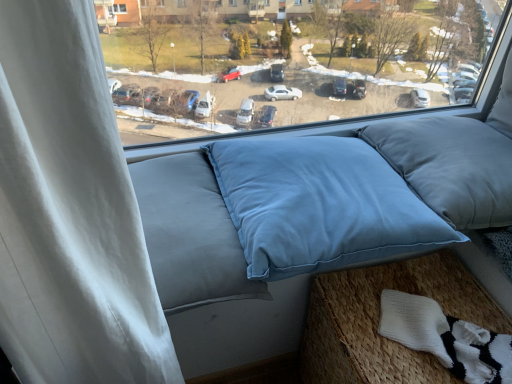
Question: From the image's perspective, is light blue fabric cushion at lower right located above white knitted socks at lower right?

Choices:
 (A) yes
 (B) no

Answer: (B)

Question: Does light blue fabric cushion at lower right lie behind white knitted socks at lower right?

Choices:
 (A) yes
 (B) no

Answer: (B)

Question: Can you confirm if light blue fabric cushion at lower right is wider than white knitted socks at lower right?

Choices:
 (A) no
 (B) yes

Answer: (B)

Question: From a real-world perspective, is light blue fabric cushion at lower right under white knitted socks at lower right?

Choices:
 (A) no
 (B) yes

Answer: (B)

Question: Would you consider light blue fabric cushion at lower right to be distant from white knitted socks at lower right?

Choices:
 (A) no
 (B) yes

Answer: (A)

Question: Is light blue fabric cushion at lower right bigger or smaller than white knitted socks at lower right?

Choices:
 (A) small
 (B) big

Answer: (B)

Question: Do you think light blue fabric cushion at lower right is within white knitted socks at lower right, or outside of it?

Choices:
 (A) inside
 (B) outside

Answer: (B)

Question: Considering the positions of light blue fabric cushion at lower right and white knitted socks at lower right in the image, is light blue fabric cushion at lower right wider or thinner than white knitted socks at lower right?

Choices:
 (A) thin
 (B) wide

Answer: (B)

Question: From the image's perspective, is light blue fabric cushion at lower right positioned above or below white knitted socks at lower right?

Choices:
 (A) above
 (B) below

Answer: (B)

Question: In terms of height, does blue fabric pillows at center look taller or shorter compared to blue fabric pillow at center, the first pillow from the left?

Choices:
 (A) short
 (B) tall

Answer: (B)

Question: Considering the positions of blue fabric pillows at center and blue fabric pillow at center, the first pillow from the left, in the image, is blue fabric pillows at center wider or thinner than blue fabric pillow at center, the first pillow from the left,?

Choices:
 (A) thin
 (B) wide

Answer: (A)

Question: Based on their sizes in the image, would you say blue fabric pillows at center is bigger or smaller than blue fabric pillow at center, the first pillow from the left?

Choices:
 (A) big
 (B) small

Answer: (A)

Question: From the image's perspective, is blue fabric pillows at center above or below blue fabric pillow at center, the first pillow from the left?

Choices:
 (A) above
 (B) below

Answer: (A)

Question: Is satin blue pillow at center, the second pillow when ordered from left to right, to the left or to the right of blue fabric pillow at center, which appears as the 2th pillow when viewed from the right, in the image?

Choices:
 (A) left
 (B) right

Answer: (B)

Question: Considering the positions of point (402, 122) and point (240, 211), is point (402, 122) closer or farther from the camera than point (240, 211)?

Choices:
 (A) closer
 (B) farther

Answer: (B)